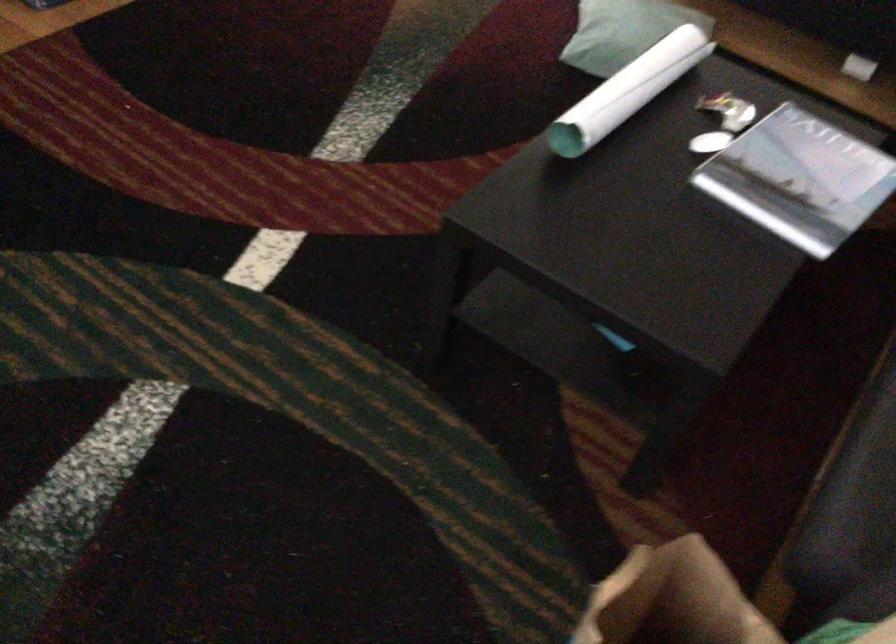
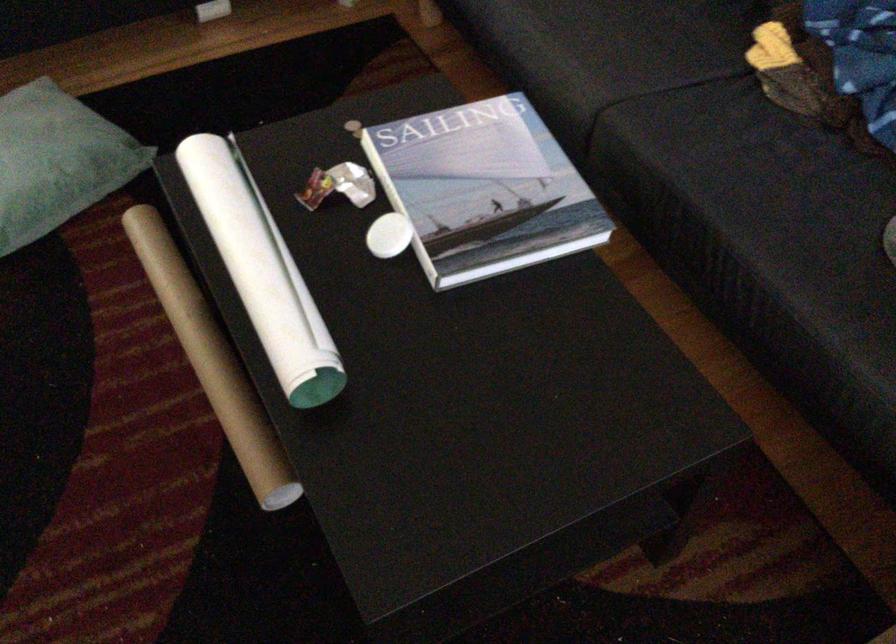
In the second image, find the point that corresponds to (793,172) in the first image.

(484, 190)